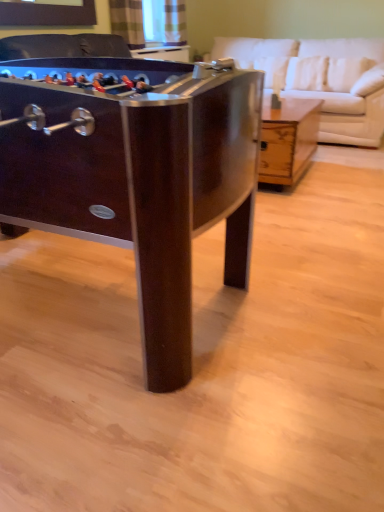
You are a GUI agent. You are given a task and a screenshot of the screen. Output one action in this format:
    pyautogui.click(x=<x>, y=<y>)
    Task: Click on the free location to the right of dark wood foosball table at left, the 1th table positioned from the front
    This screenshot has width=384, height=512.
    Given the screenshot: What is the action you would take?
    pyautogui.click(x=314, y=288)